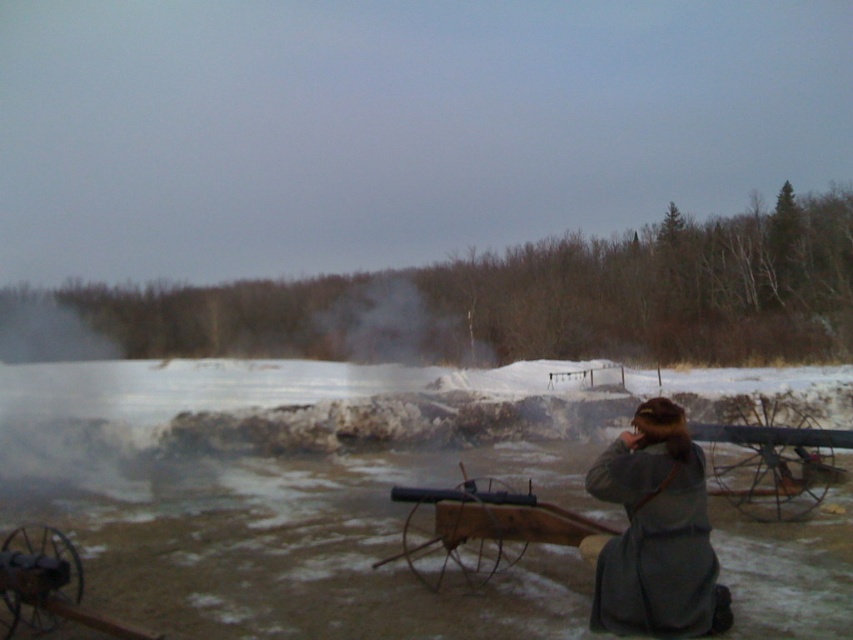
You are a photographer at the historical event. You want to capture a photo that includes both the gray wool coat at lower right and the black matte cannon at lower left. Based on their positions, which object should be placed closer to the bottom edge of the photo?

The gray wool coat at lower right is located above the black matte cannon at lower left, so to include both in the photo, the black matte cannon at lower left should be placed closer to the bottom edge since it is positioned lower.

You are standing at the center of the image. Which direction should you move to reach the gray wool coat at lower right?

You should move to the lower right direction to reach the gray wool coat at lower right.